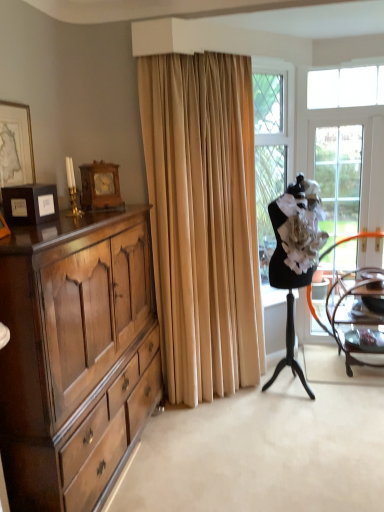
Question: Considering the positions of gold-framed picture at upper left and beige velvet curtain at center in the image, is gold-framed picture at upper left wider or thinner than beige velvet curtain at center?

Choices:
 (A) thin
 (B) wide

Answer: (A)

Question: Visually, is gold-framed picture at upper left positioned to the left or to the right of beige velvet curtain at center?

Choices:
 (A) left
 (B) right

Answer: (A)

Question: Which of these objects is positioned farthest from the beige velvet curtain at center?

Choices:
 (A) polished wood cabinet at left
 (B) wooden chair at right
 (C) white fabric ballet dancer at right
 (D) clear glass screen door at right
 (E) gold-framed picture at upper left

Answer: (D)

Question: Which object is the farthest from the beige velvet curtain at center?

Choices:
 (A) gold-framed picture at upper left
 (B) polished wood cabinet at left
 (C) clear glass screen door at right
 (D) wooden chair at right
 (E) white fabric ballet dancer at right

Answer: (C)